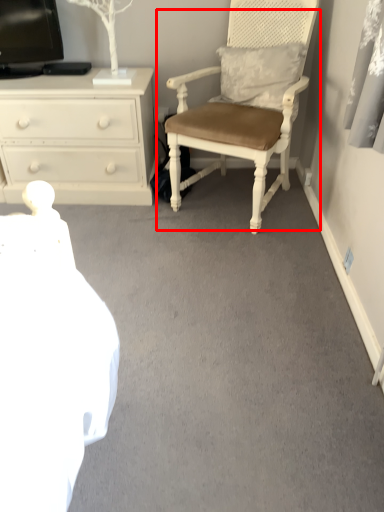
Question: Considering the relative positions of chair (annotated by the red box) and chest of drawers in the image provided, where is chair (annotated by the red box) located with respect to the staircase?

Choices:
 (A) right
 (B) left

Answer: (A)